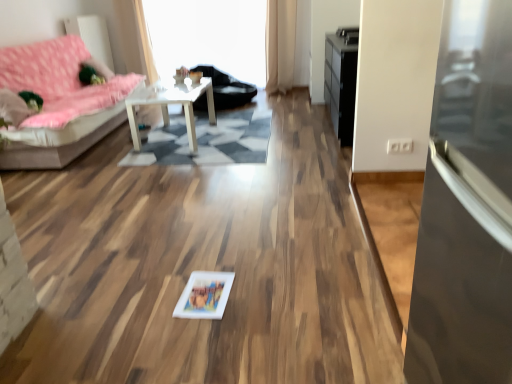
Question: Which is correct: black glossy dresser at upper right is inside white glossy picture frame at center, or outside of it?

Choices:
 (A) outside
 (B) inside

Answer: (A)

Question: Is black glossy dresser at upper right wider or thinner than white glossy picture frame at center?

Choices:
 (A) thin
 (B) wide

Answer: (B)

Question: Estimate the real-world distances between objects in this image. Which object is closer to the white glossy table at center?

Choices:
 (A) white glossy picture frame at center
 (B) transparent glass door at right
 (C) beige fabric curtain at upper center
 (D) black leather armchair at center
 (E) transparent glass window screen at upper center

Answer: (D)

Question: Which object is the farthest from the pink fabric studio couch at left?

Choices:
 (A) white glossy table at center
 (B) transparent glass window screen at upper center
 (C) black glossy dresser at upper right
 (D) transparent glass door at right
 (E) white glossy picture frame at center

Answer: (D)